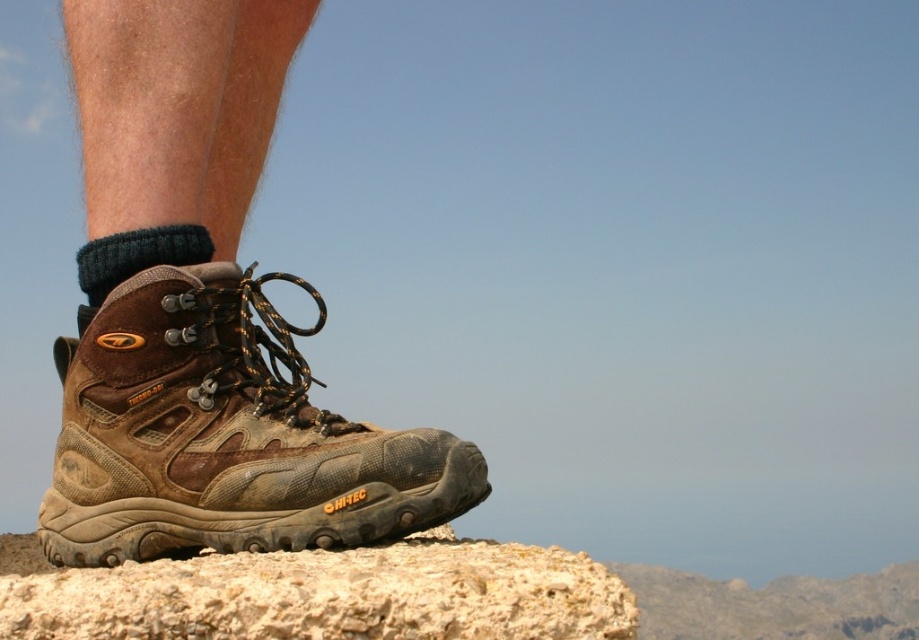
Who is lower down, brown textured rock at lower left or dark blue knitted sock at lower left?

brown textured rock at lower left is lower down.

Describe the element at coordinates (330, 595) in the screenshot. I see `brown textured rock at lower left` at that location.

Is point (494, 616) farther from camera compared to point (108, 248)?

No, it is in front of (108, 248).

I want to click on brown textured rock at lower left, so click(330, 595).

Between brown leather boot at lower left and dark blue knitted sock at lower left, which one appears on the right side from the viewer's perspective?

Positioned to the right is brown leather boot at lower left.

The image size is (919, 640). Describe the element at coordinates (224, 435) in the screenshot. I see `brown leather boot at lower left` at that location.

Identify the location of brown leather boot at lower left. (224, 435).

This screenshot has height=640, width=919. Describe the element at coordinates (224, 435) in the screenshot. I see `brown leather boot at lower left` at that location.

Where is `brown leather boot at lower left`? Image resolution: width=919 pixels, height=640 pixels. brown leather boot at lower left is located at coordinates (224, 435).

Identify the location of brown leather boot at lower left. (224, 435).